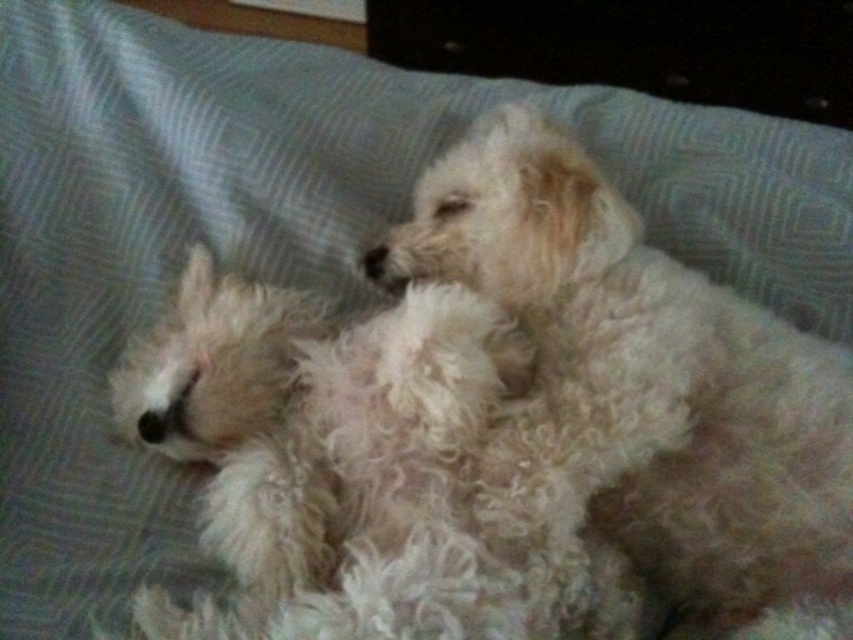
You are a photographer trying to capture a photo of the two dogs. You want to position your camera so that the fluffy white dog at center and the white fluffy dog at center are both in the frame. Which dog should you place closer to the left side of the camera frame?

You should place the white fluffy dog at center closer to the left side of the camera frame because the fluffy white dog at center is to the right of it.

You are a photographer trying to capture a closeup of the fluffy white dog at center without the white fluffy dog at center appearing in the shot. Is this possible given their positions?

The white fluffy dog at center is behind the fluffy white dog at center, so you can take a closeup of the fluffy white dog at center without the white fluffy dog at center being visible in the shot.